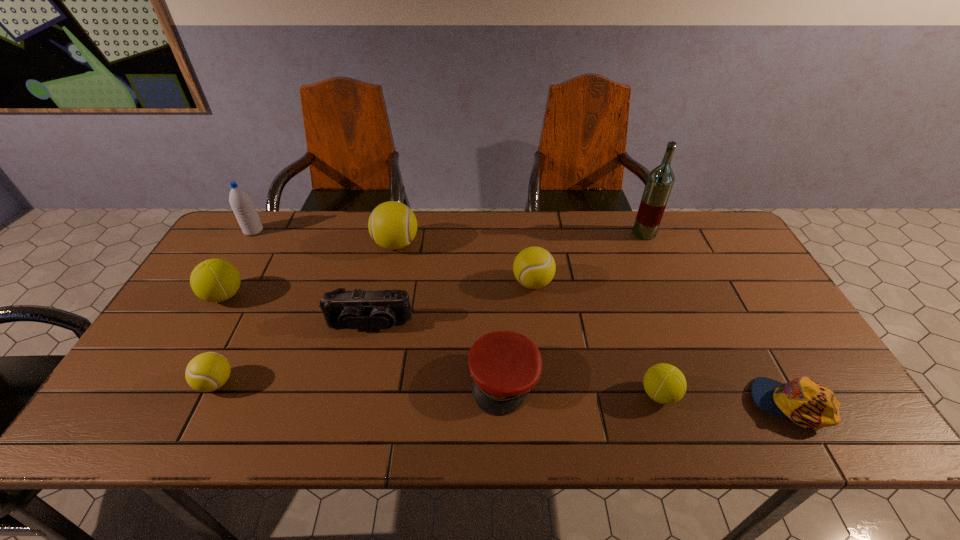
Locate an element on the screen. Image resolution: width=960 pixels, height=540 pixels. vacant space situated on the back of the second tennis ball from right to left is located at coordinates pos(527,240).

Identify the location of free spot located 0.110m on the right of the left green tennis ball. This screenshot has height=540, width=960. (284, 295).

Locate an element on the screen. This screenshot has width=960, height=540. vacant area located 0.050m on the front-facing side of the camcorder is located at coordinates (363, 350).

The width and height of the screenshot is (960, 540). In order to click on blank space located on the back of the smallest yellow tennis ball in this screenshot , I will do (262, 291).

Find the location of a particular element. Image resolution: width=960 pixels, height=540 pixels. vacant space situated on the back of the right green tennis ball is located at coordinates (633, 315).

Locate an element on the screen. Image resolution: width=960 pixels, height=540 pixels. vacant space located 0.060m on the bill of the rightmost object is located at coordinates (725, 404).

At what (x,y) coordinates should I click in order to perform the action: click on vacant region located 0.280m on the bill of the rightmost object. Please return your answer as a coordinate pair (x, y). Looking at the image, I should click on (629, 404).

Image resolution: width=960 pixels, height=540 pixels. Identify the location of vacant area situated 0.180m on the bill of the rightmost object. (672, 404).

Find the location of a particular element. This screenshot has width=960, height=540. liquor that is at the far edge is located at coordinates (660, 181).

Identify the location of water bottle at the far edge. This screenshot has height=540, width=960. (241, 203).